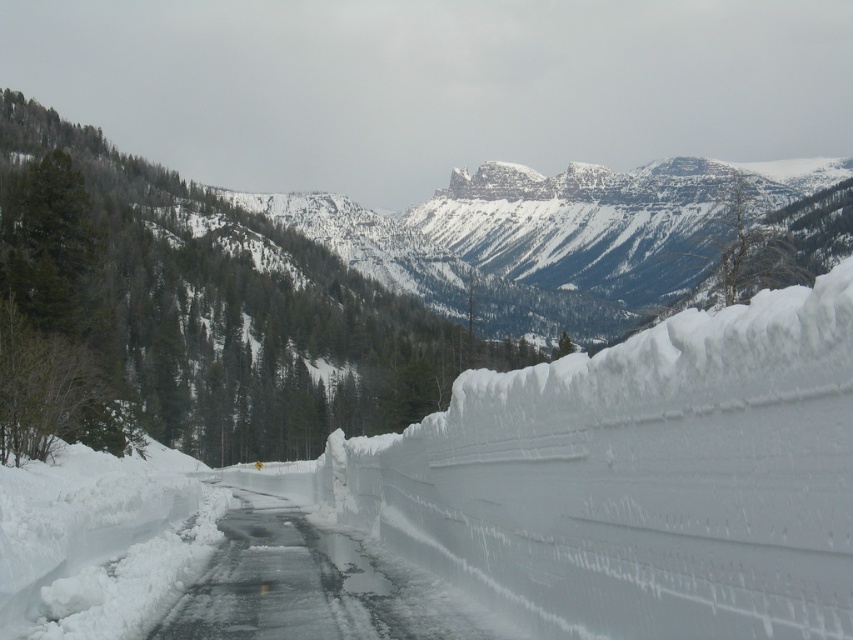
You are navigating a drone over a winter landscape. The snowy mountain at center is your destination. According to the coordinates provided, where exactly should you direct the drone to land?

The snowy mountain at center is located at coordinates point (347, 285), so you should direct the drone to land there.

You are standing at the edge of the snowbank and want to walk towards the point marked as point (412, 397) and point (345, 592). Which point will you reach first?

You will reach point (345, 592) first because it is closer to you than point (412, 397), which is further away.

You are a snowplow operator needing to clear the snowy mountain at center and the icy asphalt road at center. Which of the two requires a wider plow blade to handle its width?

The snowy mountain at center requires a wider plow blade since its width surpasses that of the icy asphalt road at center.